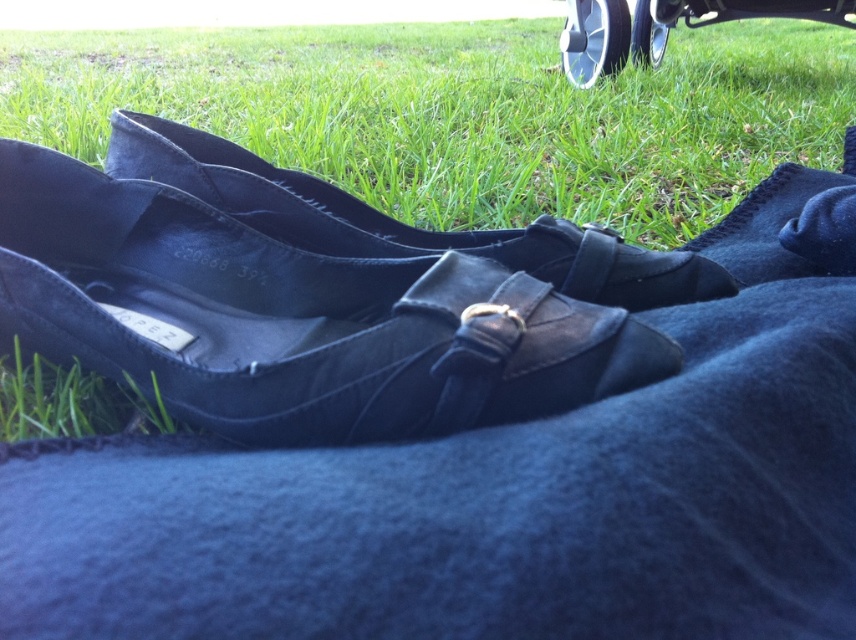
Who is more forward, [110,150] or [574,45]?

Positioned in front is point [110,150].

Who is lower down, matte black shoe at center or silver metallic wheel at upper right?

matte black shoe at center is lower down.

Image resolution: width=856 pixels, height=640 pixels. Find the location of `matte black shoe at center`. matte black shoe at center is located at coordinates (401, 221).

Based on the photo, who is more distant from viewer, (169, 337) or (569, 262)?

The point (569, 262) is more distant.

Does matte black dress shoe at center have a lesser width compared to matte black shoe at center?

Yes.

Between point (550, 349) and point (377, 248), which one is positioned behind?

The point (377, 248) is more distant.

This screenshot has height=640, width=856. I want to click on matte black dress shoe at center, so click(340, 353).

Does green grass at center appear over matte black dress shoe at center?

Yes.

Does point (443, 205) come farther from viewer compared to point (9, 282)?

Yes, point (443, 205) is behind point (9, 282).

Is point (562, 102) more distant than point (107, 291)?

Yes, it is behind point (107, 291).

Locate an element on the screen. green grass at center is located at coordinates (462, 113).